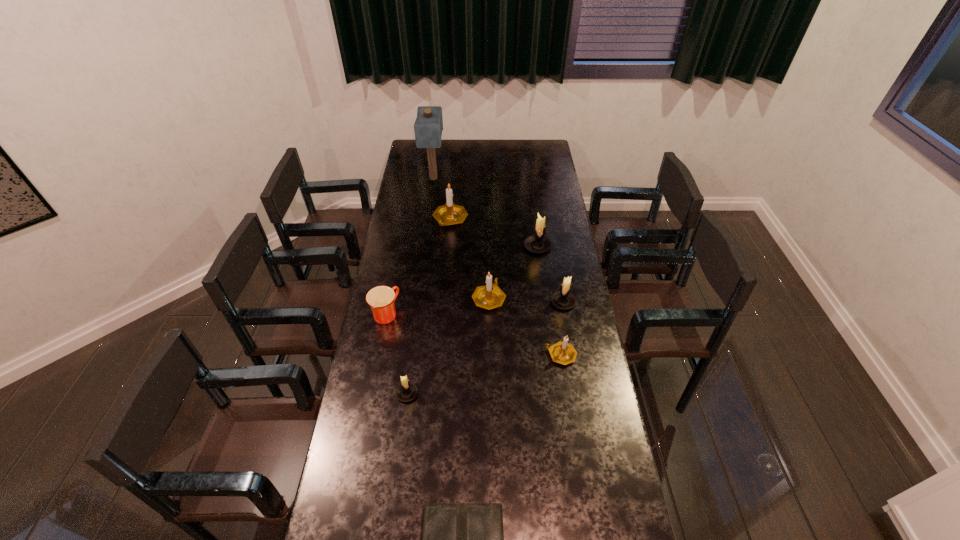
You are a GUI agent. You are given a task and a screenshot of the screen. Output one action in this format:
    pyautogui.click(x=<x>, y=<y>)
    Task: Click on the tallest object
    Image resolution: width=960 pixels, height=540 pixels.
    Given the screenshot: What is the action you would take?
    pyautogui.click(x=428, y=126)

Find the location of a particular element. The width and height of the screenshot is (960, 540). brown mallet is located at coordinates (428, 126).

This screenshot has height=540, width=960. I want to click on the biggest gold candle holder, so click(450, 213).

The height and width of the screenshot is (540, 960). What are the coordinates of `the second farthest object` in the screenshot? It's located at (450, 213).

Identify the location of the biggest white candle holder. (538, 243).

Find the location of a particular element. Image resolution: width=960 pixels, height=540 pixels. the seventh nearest object is located at coordinates (538, 243).

The image size is (960, 540). In order to click on the second gold candle holder from right to left in this screenshot , I will do `click(490, 296)`.

The image size is (960, 540). In order to click on the third candle holder from left to right in this screenshot , I will do `click(490, 296)`.

At what (x,y) coordinates should I click in order to perform the action: click on the second biggest white candle holder. Please return your answer as a coordinate pair (x, y). The height and width of the screenshot is (540, 960). Looking at the image, I should click on (563, 299).

You are a GUI agent. You are given a task and a screenshot of the screen. Output one action in this format:
    pyautogui.click(x=<x>, y=<y>)
    Task: Click on the nearest candle holder
    
    Given the screenshot: What is the action you would take?
    pyautogui.click(x=407, y=391)